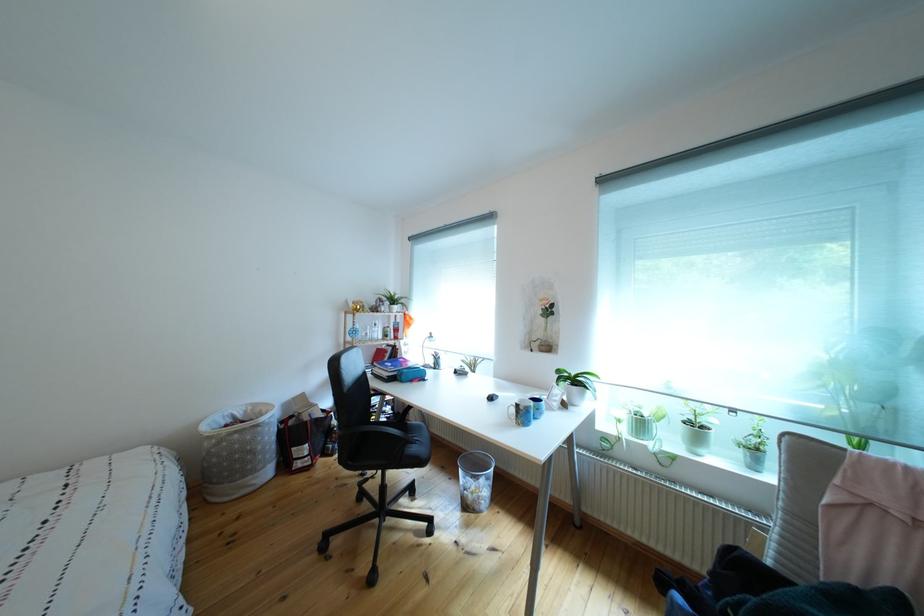
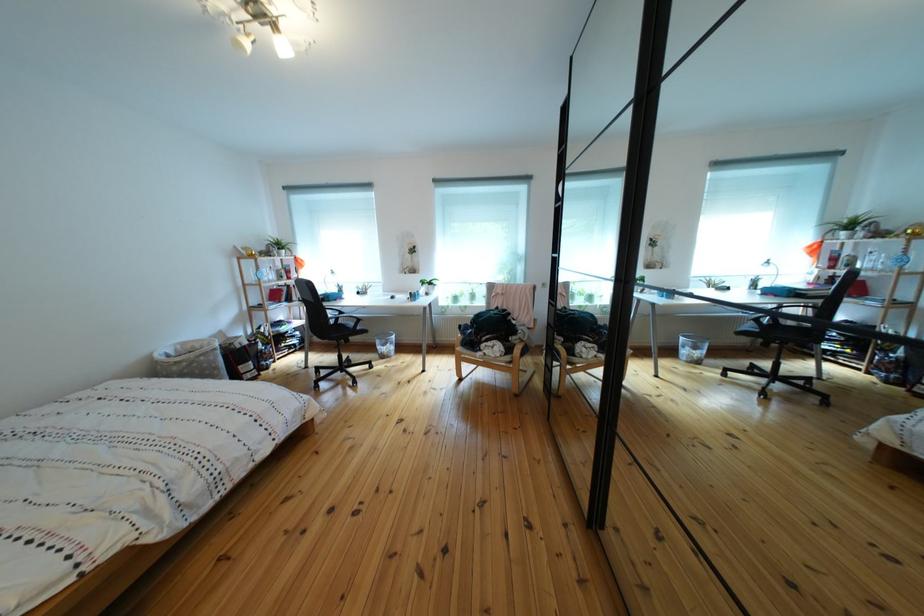
Where in the second image is the point corresponding to the point at 257,418 from the first image?

(187, 355)